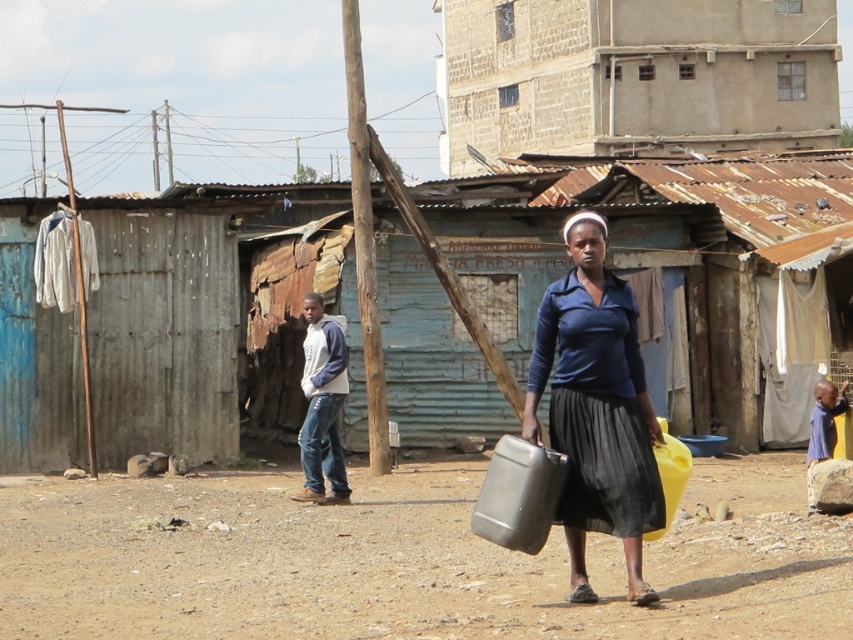
Question: Among these points, which one is nearest to the camera?

Choices:
 (A) (587, 496)
 (B) (436, 634)
 (C) (596, 28)
 (D) (341, 225)

Answer: (B)

Question: Does brown dirt field at center lie in front of rusty corrugated metal hut at center?

Choices:
 (A) no
 (B) yes

Answer: (B)

Question: Which point is closer to the camera?

Choices:
 (A) brown dirt field at center
 (B) rusty corrugated metal hut at center
 (C) brown stucco building at upper center
 (D) matte black water container at center

Answer: (A)

Question: Which point appears closest to the camera in this image?

Choices:
 (A) (268, 499)
 (B) (521, 58)

Answer: (A)

Question: Does brown stucco building at upper center appear on the left side of matte black water container at center?

Choices:
 (A) yes
 (B) no

Answer: (A)

Question: Can you confirm if rusty corrugated metal hut at center is positioned above brown stucco building at upper center?

Choices:
 (A) no
 (B) yes

Answer: (A)